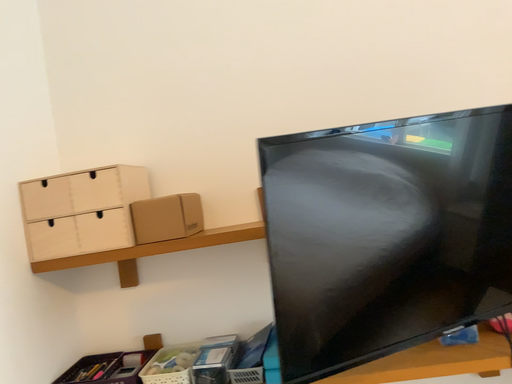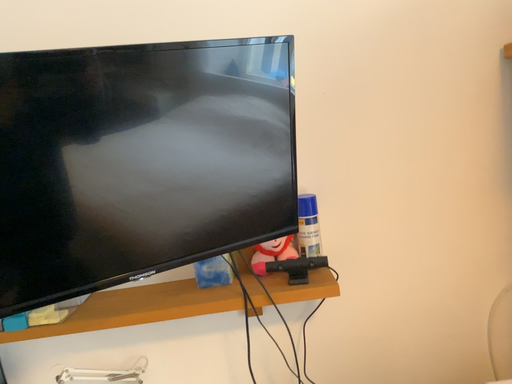
Question: How did the camera likely rotate when shooting the video?

Choices:
 (A) rotated upward
 (B) rotated downward

Answer: (B)